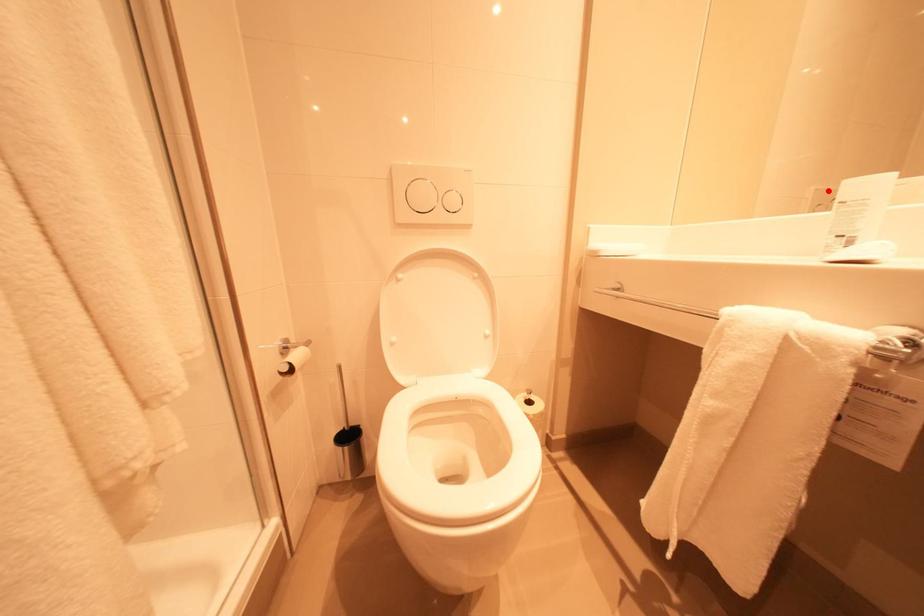
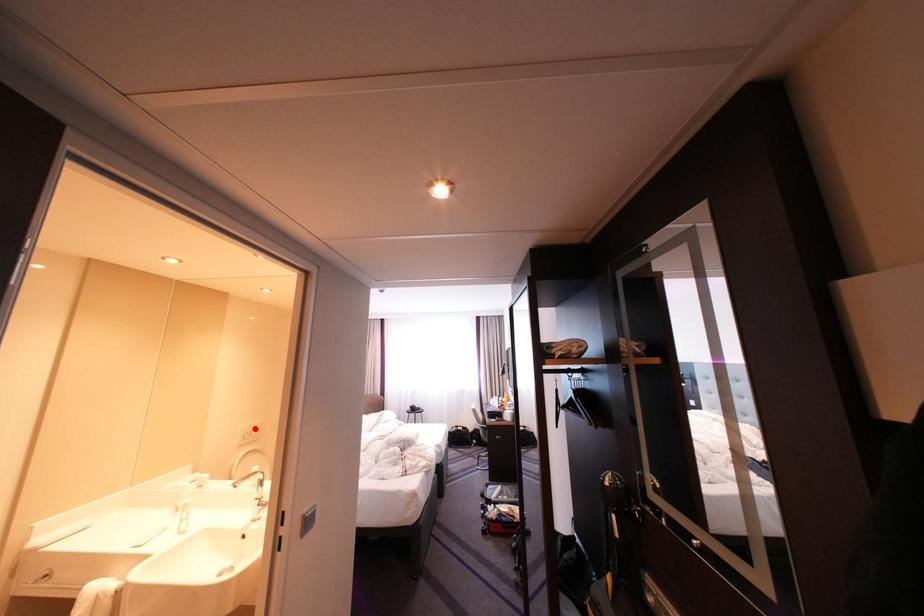
I am providing you with two images of the same scene from different viewpoints. A red point is marked on the first image and another point is marked on the second image. Does the point marked in image1 correspond to the same location as the one in image2?

Yes